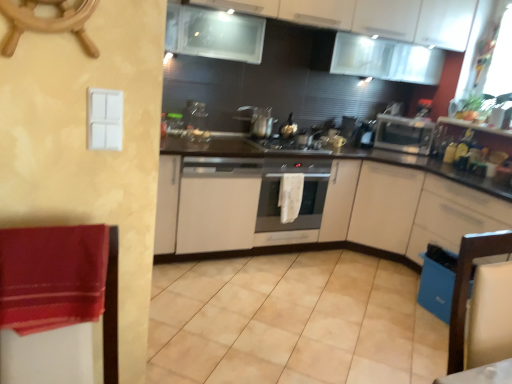
Identify the location of vacant area on top of beige tile at center (from a real-world perspective). The image size is (512, 384). (288, 311).